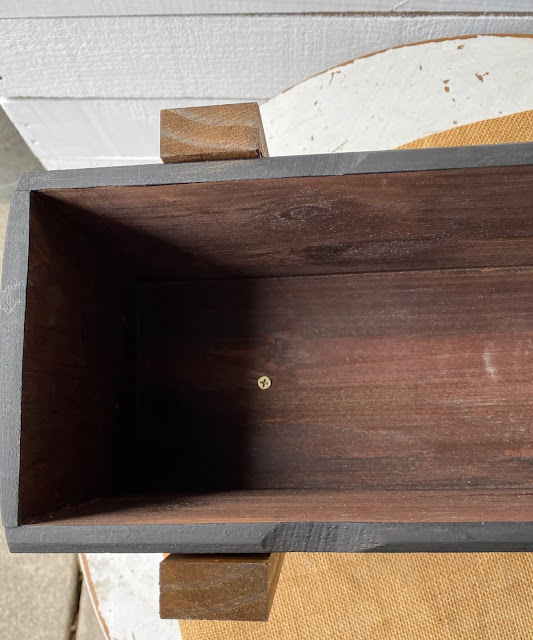
Image resolution: width=533 pixels, height=640 pixels. What are the coordinates of `wood grain` in the screenshot? It's located at (419, 284), (349, 386), (346, 411), (357, 406), (263, 205), (224, 116), (217, 114), (238, 116), (243, 141).